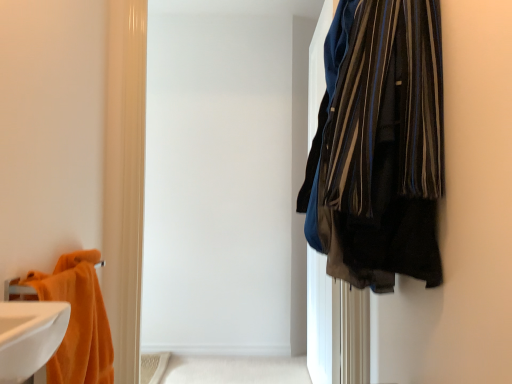
Locate an element on the screen. beige fabric bath mat at lower center is located at coordinates (236, 370).

What do you see at coordinates (236, 370) in the screenshot? I see `beige fabric bath mat at lower center` at bounding box center [236, 370].

What is the approximate height of orange plush towel at left?

orange plush towel at left is 19.26 inches tall.

Describe the element at coordinates (77, 320) in the screenshot. The height and width of the screenshot is (384, 512). I see `orange plush towel at left` at that location.

You are a GUI agent. You are given a task and a screenshot of the screen. Output one action in this format:
    pyautogui.click(x=<x>, y=<y>)
    Task: Click on the orange plush towel at left
    
    Given the screenshot: What is the action you would take?
    pyautogui.click(x=77, y=320)

Identify the location of beige fabric bath mat at lower center. (236, 370).

Which object is positioned more to the right, orange plush towel at left or beige fabric bath mat at lower center?

From the viewer's perspective, beige fabric bath mat at lower center appears more on the right side.

Relative to beige fabric bath mat at lower center, is orange plush towel at left in front or behind?

Visually, orange plush towel at left is located in front of beige fabric bath mat at lower center.

Which point is more distant from viewer, (58, 267) or (270, 364)?

The point (270, 364) is more distant.

From the image's perspective, does orange plush towel at left appear higher than beige fabric bath mat at lower center?

Yes, from the image's perspective, orange plush towel at left is on top of beige fabric bath mat at lower center.

From a real-world perspective, does orange plush towel at left sit lower than beige fabric bath mat at lower center?

Actually, orange plush towel at left is physically above beige fabric bath mat at lower center in the real world.

Looking at their sizes, would you say orange plush towel at left is wider or thinner than beige fabric bath mat at lower center?

Considering their sizes, orange plush towel at left looks slimmer than beige fabric bath mat at lower center.

Considering the sizes of objects orange plush towel at left and beige fabric bath mat at lower center in the image provided, who is shorter, orange plush towel at left or beige fabric bath mat at lower center?

With less height is beige fabric bath mat at lower center.

Is orange plush towel at left bigger than beige fabric bath mat at lower center?

Yes.

Can we say orange plush towel at left lies outside beige fabric bath mat at lower center?

Yes, orange plush towel at left is not within beige fabric bath mat at lower center.

Are orange plush towel at left and beige fabric bath mat at lower center far apart?

orange plush towel at left is far away from beige fabric bath mat at lower center.

Is orange plush towel at left oriented away from beige fabric bath mat at lower center?

No.

Locate an element on the screen. The height and width of the screenshot is (384, 512). bath that appears on the right of orange plush towel at left is located at coordinates (236, 370).

In the image, is beige fabric bath mat at lower center on the left side or the right side of orange plush towel at left?

Based on their positions, beige fabric bath mat at lower center is located to the right of orange plush towel at left.

Which object is further away from the camera taking this photo, beige fabric bath mat at lower center or orange plush towel at left?

beige fabric bath mat at lower center is further from the camera.

Is point (282, 367) closer or farther from the camera than point (87, 371)?

Clearly, point (282, 367) is more distant from the camera than point (87, 371).

From the image's perspective, is beige fabric bath mat at lower center below orange plush towel at left?

Yes, from the image's perspective, beige fabric bath mat at lower center is beneath orange plush towel at left.

From a real-world perspective, does beige fabric bath mat at lower center stand above orange plush towel at left?

No, from a real-world perspective, beige fabric bath mat at lower center is not on top of orange plush towel at left.

Which object is wider, beige fabric bath mat at lower center or orange plush towel at left?

beige fabric bath mat at lower center is wider.

In terms of height, does beige fabric bath mat at lower center look taller or shorter compared to orange plush towel at left?

Clearly, beige fabric bath mat at lower center is shorter compared to orange plush towel at left.

Looking at this image, considering the sizes of objects beige fabric bath mat at lower center and orange plush towel at left in the image provided, who is bigger, beige fabric bath mat at lower center or orange plush towel at left?

Bigger between the two is orange plush towel at left.

Does beige fabric bath mat at lower center contain orange plush towel at left?

No.

Would you say beige fabric bath mat at lower center is a long distance from orange plush towel at left?

Indeed, beige fabric bath mat at lower center is not near orange plush towel at left.

Is beige fabric bath mat at lower center facing away from orange plush towel at left?

No.

How different are the orientations of beige fabric bath mat at lower center and orange plush towel at left in degrees?

There is a 90.9-degree angle between the facing directions of beige fabric bath mat at lower center and orange plush towel at left.

Where is `towel that is on the left side of beige fabric bath mat at lower center`? towel that is on the left side of beige fabric bath mat at lower center is located at coordinates (77, 320).

The image size is (512, 384). In order to click on towel in front of the beige fabric bath mat at lower center in this screenshot , I will do `click(77, 320)`.

Identify the location of towel that appears above the beige fabric bath mat at lower center (from a real-world perspective). (77, 320).